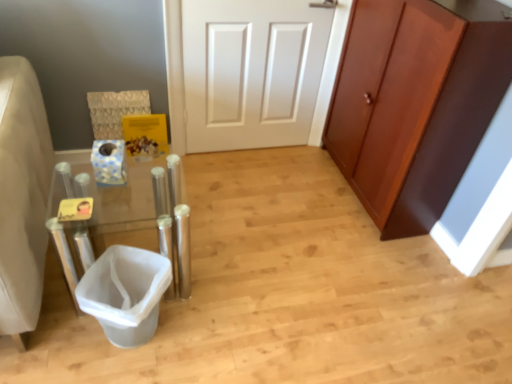
Question: From a real-world perspective, is clear acrylic vanity at left above or below white plastic trash can at lower left?

Choices:
 (A) below
 (B) above

Answer: (B)

Question: Do you think clear acrylic vanity at left is within white plastic trash can at lower left, or outside of it?

Choices:
 (A) inside
 (B) outside

Answer: (B)

Question: Which is farther from the clear acrylic vanity at left?

Choices:
 (A) white plastic trash can at lower left
 (B) brown wood cabinet at right

Answer: (B)

Question: Which is farther from the clear acrylic vanity at left?

Choices:
 (A) white plastic trash can at lower left
 (B) brown wood cabinet at right

Answer: (B)